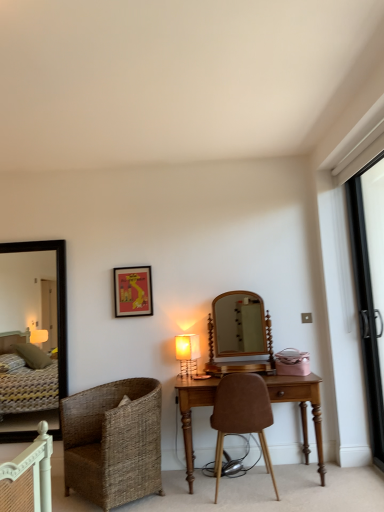
Question: Considering the positions of point (188, 386) and point (66, 392), is point (188, 386) closer or farther from the camera than point (66, 392)?

Choices:
 (A) closer
 (B) farther

Answer: (A)

Question: From the image's perspective, is wooden desk at center positioned above or below black wooden mirror at left?

Choices:
 (A) above
 (B) below

Answer: (B)

Question: Estimate the real-world distances between objects in this image. Which object is farther from the matte red picture frame at upper center?

Choices:
 (A) woven brown chair at lower left, which is the second chair in right-to-left order
 (B) wooden desk at center
 (C) clear glass screen door at right
 (D) brown leather chair at center, arranged as the second chair when viewed from the left
 (E) black wooden mirror at left

Answer: (C)

Question: Which is farther from the metallic gold table lamp at center?

Choices:
 (A) woven brown chair at lower left, which is the second chair in right-to-left order
 (B) matte red picture frame at upper center
 (C) wooden desk at center
 (D) brown leather chair at center, positioned as the first chair in right-to-left order
 (E) black wooden mirror at left

Answer: (E)